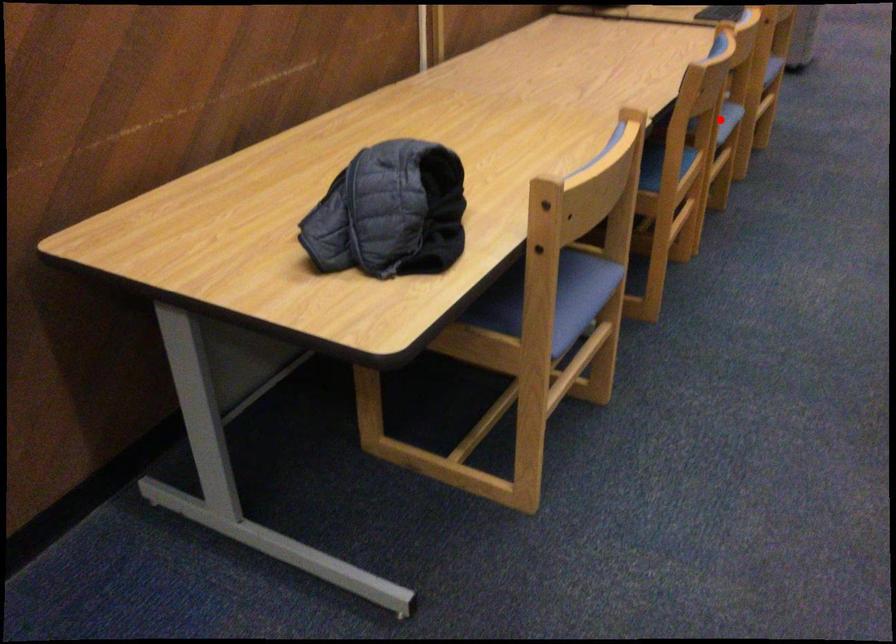
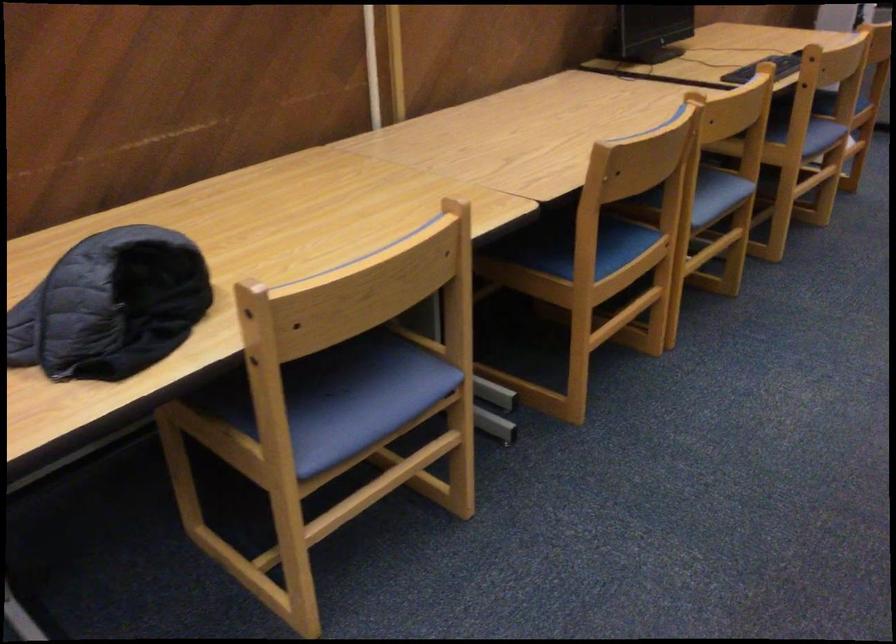
Question: I am providing you with two images of the same scene from different viewpoints. A red point is shown in image1. For the corresponding object point in image2, is it positioned nearer or farther from the camera?

Choices:
 (A) Nearer
 (B) Farther

Answer: (A)